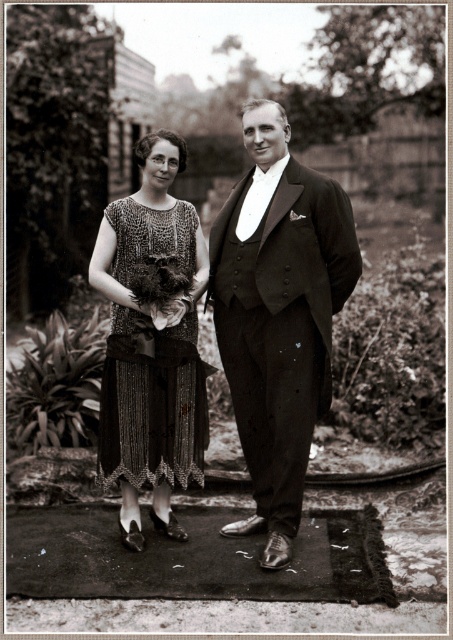
Consider the image. You are an interior designer planning to place a large sofa and a small side table in a room. The sofa must match the smooth black suit at center, and the side table must match the sequined fabric dress at center. Given their sizes, will the sofa and side table fit proportionally in the room?

The smooth black suit at center is larger than the sequined fabric dress at center, so the sofa will be larger than the side table, which fits proportionally as the sofa is meant to be the main furniture piece and the side table a smaller accessory.

You are a photographer adjusting your camera to focus on the smooth black suit at center and the sequined fabric dress at center. Which one should you focus on first to ensure both are in focus?

You should focus on the smooth black suit at center first since it is closer to the viewer than the sequined fabric dress at center, allowing you to adjust the focus from near to far for both subjects.